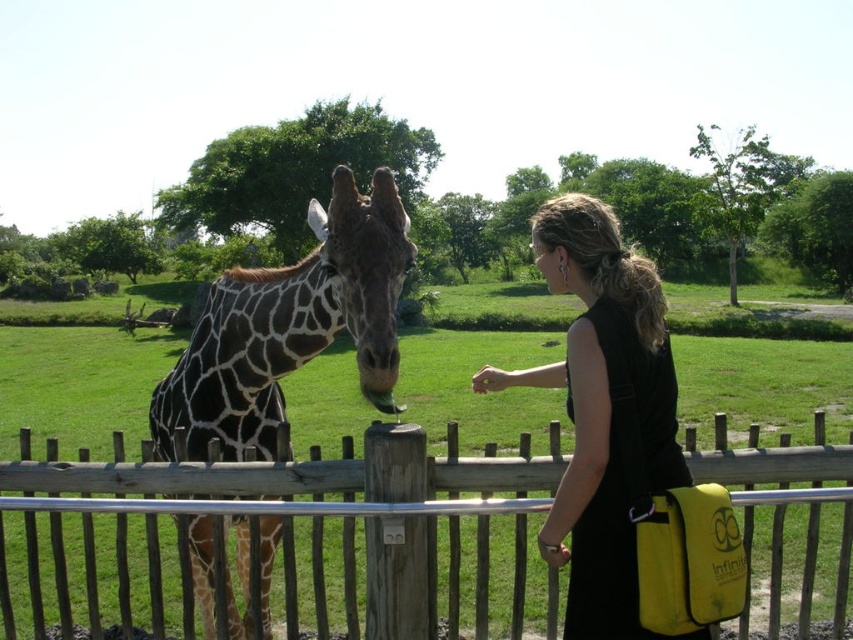
You are a visitor at the zoo trying to locate two specific points marked in the image. The first point is at coordinates point (801, 524) and the second is at point (193, 394). From your perspective standing in front of the giraffe, which point is closer to you?

Point (193, 394) is closer to you because point (801, 524) is behind it.

You are a zookeeper trying to ensure the safety of both visitors and animals. The wooden fence at center and spotted fur giraffe at center are in close proximity. Based on their sizes, which object is more likely to block a visitor from reaching the giraffe?

The wooden fence at center is much taller than the spotted fur giraffe at center, making it the more effective barrier between the visitor and the giraffe.